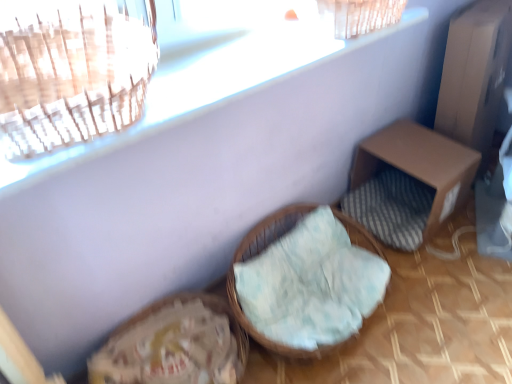
Image resolution: width=512 pixels, height=384 pixels. I want to click on vacant area on top of brown cardboard box at right, the 1th furniture from the right (from a real-world perspective), so click(409, 147).